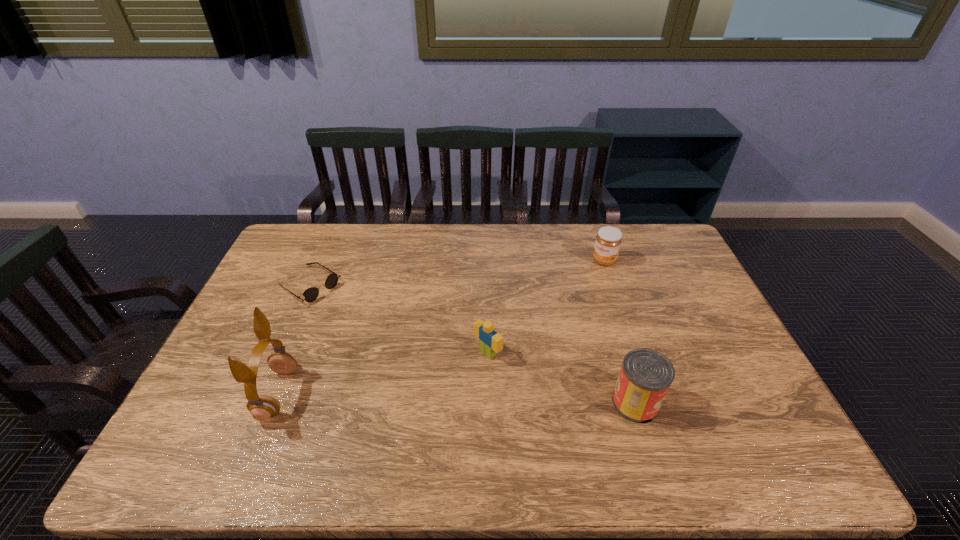
This screenshot has height=540, width=960. I want to click on vacant region between the sunglasses and the earphone, so click(294, 339).

Where is `empty space between the can and the third object from right to left`? empty space between the can and the third object from right to left is located at coordinates (562, 378).

Locate an element on the screen. The height and width of the screenshot is (540, 960). vacant space that is in between the shortest object and the third object from right to left is located at coordinates (398, 319).

Locate an element on the screen. The image size is (960, 540). vacant space that's between the tallest object and the second tallest object is located at coordinates (456, 398).

Where is `vacant area between the jam and the sunglasses`? This screenshot has height=540, width=960. vacant area between the jam and the sunglasses is located at coordinates (457, 273).

Locate an element on the screen. Image resolution: width=960 pixels, height=540 pixels. free space between the tallest object and the jam is located at coordinates (441, 327).

Image resolution: width=960 pixels, height=540 pixels. I want to click on free space between the Lego and the can, so click(x=562, y=378).

Identify the location of free space between the fourth shortest object and the jam. The width and height of the screenshot is (960, 540). (619, 332).

Where is `object identified as the fourth closest to the shortest object`? Image resolution: width=960 pixels, height=540 pixels. object identified as the fourth closest to the shortest object is located at coordinates (608, 240).

Locate which object ranks second in proximity to the shortest object. Please provide its 2D coordinates. Your answer should be formatted as a tuple, i.e. [(x, y)], where the tuple contains the x and y coordinates of a point satisfying the conditions above.

[(490, 342)]